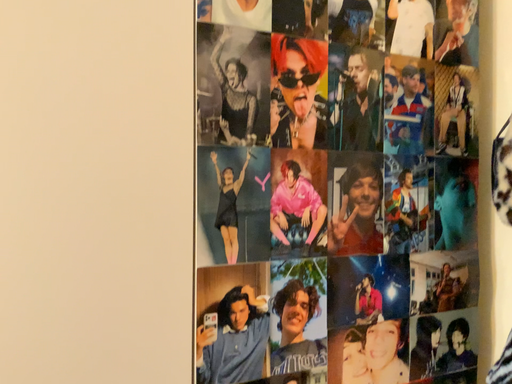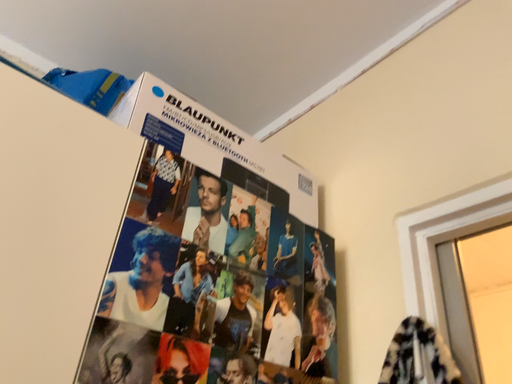
Question: How did the camera likely rotate when shooting the video?

Choices:
 (A) rotated left
 (B) rotated right

Answer: (B)